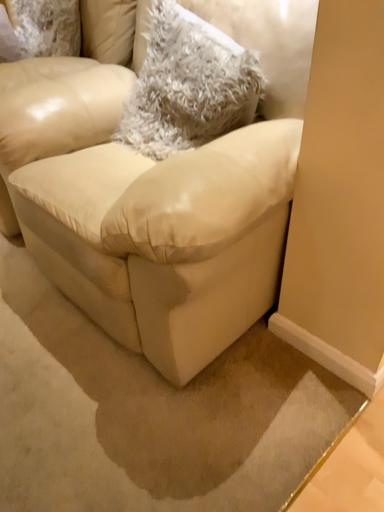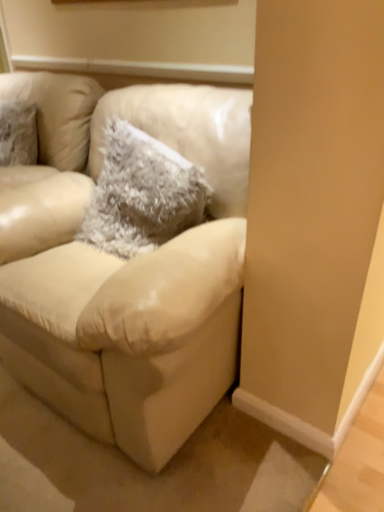
Question: Which way did the camera rotate in the video?

Choices:
 (A) rotated downward
 (B) rotated upward

Answer: (B)